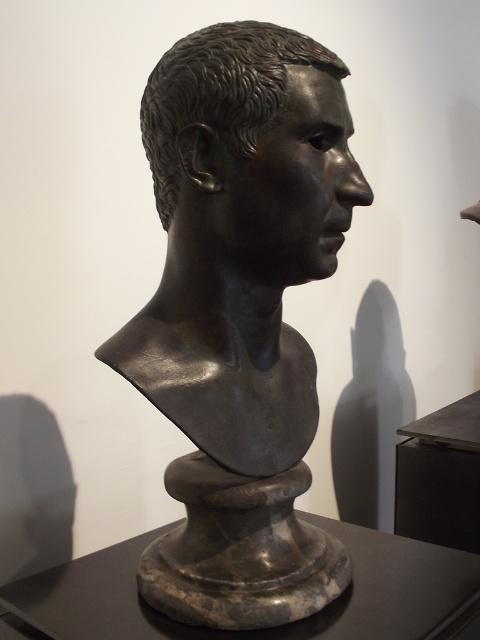
From the picture: You are an art conservator standing 1.5 meters away from the bronze bust at center. You need to measure the distance between the tip of the nose and the top of the head. Can you reach both points with a measuring tape without moving closer than your current position?

The distance between the tip of the nose and the top of the head on the bronze bust at center is 83.19 centimeters. Since you are 1.5 meters away, you can easily reach both points with a measuring tape without needing to move closer.

What are the coordinates of the bronze bust at center in the image?

The bronze bust at center is located at coordinates point (240, 316).